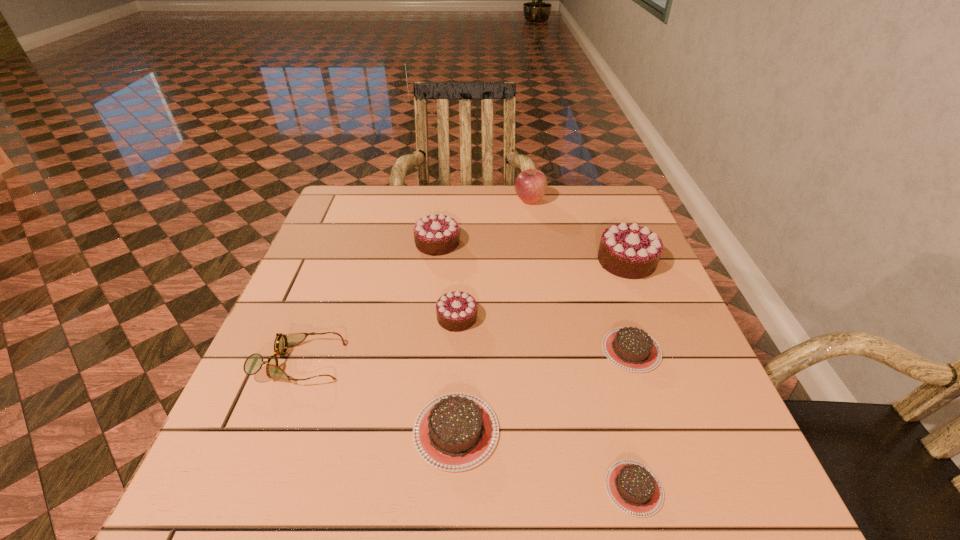
This screenshot has width=960, height=540. I want to click on vacant space that satisfies the following two spatial constraints: 1. on the back side of the sixth shortest object; 2. on the right side of the farthest object, so click(x=443, y=200).

This screenshot has height=540, width=960. What are the coordinates of `free space in the image that satisfies the following two spatial constraints: 1. on the front-facing side of the third shortest chocolate cake; 2. on the left side of the leftmost object` in the screenshot? It's located at (273, 431).

Locate an element on the screen. This screenshot has width=960, height=540. vacant region that satisfies the following two spatial constraints: 1. on the back side of the farthest brown chocolate cake; 2. on the left side of the shortest object is located at coordinates (598, 350).